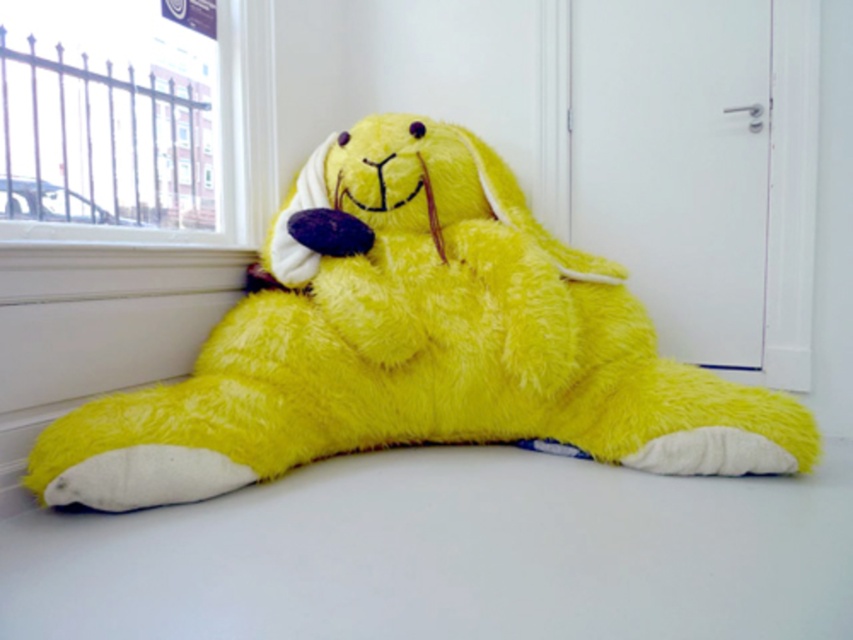
Question: Is fluffy yellow plush at center further to camera compared to metallic fence at upper left?

Choices:
 (A) no
 (B) yes

Answer: (A)

Question: Is fluffy yellow plush at center bigger than metallic fence at upper left?

Choices:
 (A) yes
 (B) no

Answer: (A)

Question: Is fluffy yellow plush at center thinner than metallic fence at upper left?

Choices:
 (A) yes
 (B) no

Answer: (B)